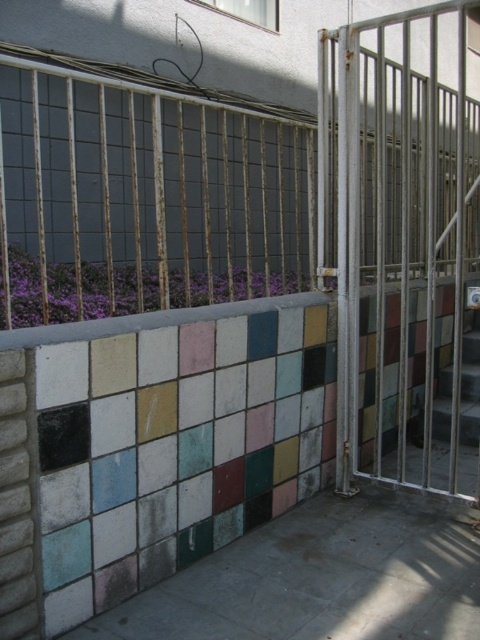
You are a painter standing in front of the building and want to paint both the rusty metal fence at center and the metallic gate at right. Which object should you paint first if you want to start with the one nearest to you?

You should paint the rusty metal fence at center first because it is closer to the viewer than the metallic gate at right.

You are a painter standing in front of the building. You need to paint both the rusty metal fence at center and the metallic gate at right. Which object will require you to reach higher to paint its top?

The metallic gate at right is taller than the rusty metal fence at center, so you will need to reach higher to paint the top of the metallic gate at right.

You are standing in front of a building with a wall and a metal gate. You see a point labeled as point (144, 198). Based on the scene description, what object does this point correspond to?

The point (144, 198) corresponds to the rusty metal fence at center.